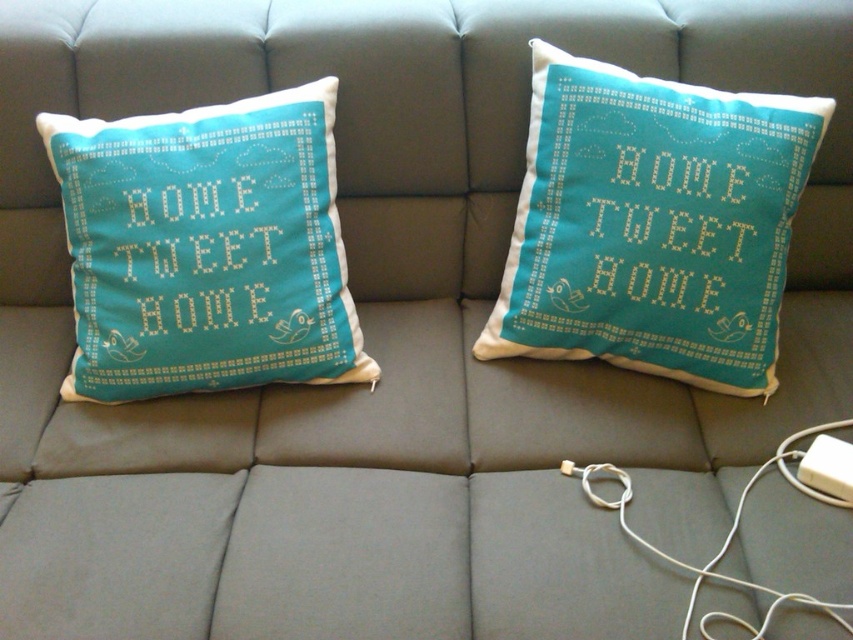
You are standing in front of the sofa with the two decorative pillows. There are two points marked on the pillows. Which point is closer to you, point (157, 317) or point (843, 474)?

Point (157, 317) is further to the camera than point (843, 474), so the closer point to you is point (843, 474).